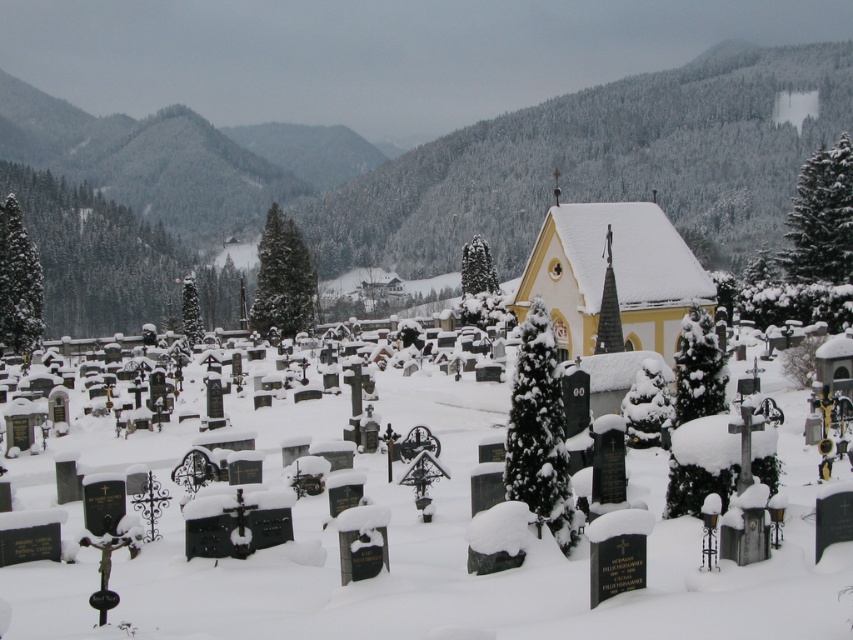
Between white matte snow at center and yellow matte church at center, which one is positioned higher?

Positioned higher is yellow matte church at center.

Is white matte snow at center thinner than yellow matte church at center?

No, white matte snow at center is not thinner than yellow matte church at center.

Find the location of a particular element. This screenshot has width=853, height=640. white matte snow at center is located at coordinates (433, 556).